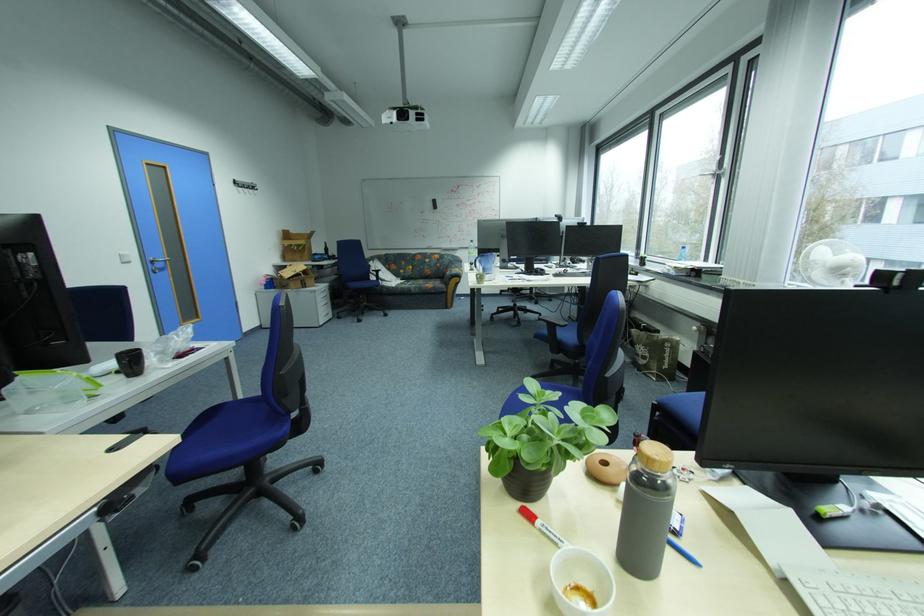
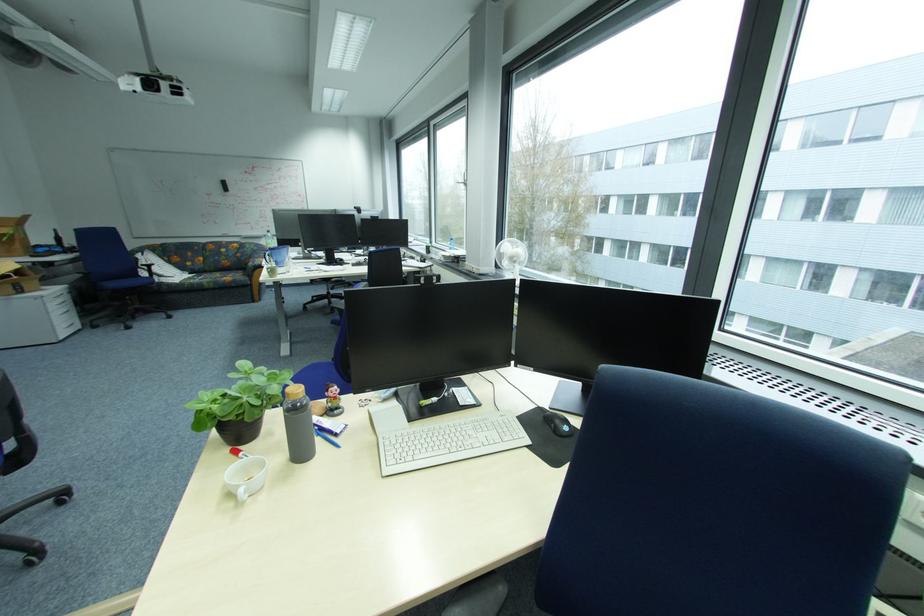
Where in the second image is the point corresponding to (x=335, y=315) from the first image?

(80, 326)